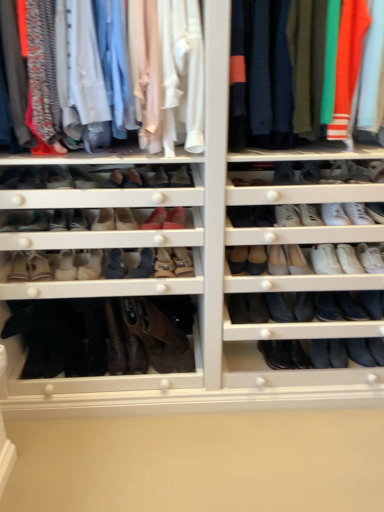
Question: Is suede brown boot at lower left, which appears as the thirteenth shoe when viewed from the right, inside or outside of matte pink leather shoe at center, arranged as the 4th shoe when viewed from the left?

Choices:
 (A) outside
 (B) inside

Answer: (A)

Question: Is suede brown boot at lower left, which appears as the thirteenth shoe when viewed from the right, in front of or behind matte pink leather shoe at center, marked as the eleventh shoe in a right-to-left arrangement, in the image?

Choices:
 (A) behind
 (B) front

Answer: (A)

Question: Considering the real-world distances, which object is farthest from the matte black boot at lower left, the first shoe in the left-to-right sequence?

Choices:
 (A) matte pink leather shoe at center, placed as the 5th shoe when sorted from left to right
 (B) white leather sneaker at center right, the eleventh shoe in the left-to-right sequence
 (C) knit sweater at upper right, the first clothing in the right-to-left sequence
 (D) suede beige boot at center, which is counted as the 9th shoe, starting from the left
 (E) black suede boot at lower right, the fourteenth shoe positioned from the left

Answer: (E)

Question: Which is farther from the matte pink leather shoe at center, which is the 9th shoe from right to left?

Choices:
 (A) matte pink shoe at center, marked as the eighth shoe in a left-to-right arrangement
 (B) suede beige boot at center, which is the 6th shoe in right-to-left order
 (C) matte cotton shirts at upper left, which is the 1th clothing from left to right
 (D) black leather boot at lower right, which ranks as the 12th shoe in left-to-right order
 (E) white leather sneaker at center right, which is the 4th shoe in right-to-left order

Answer: (D)